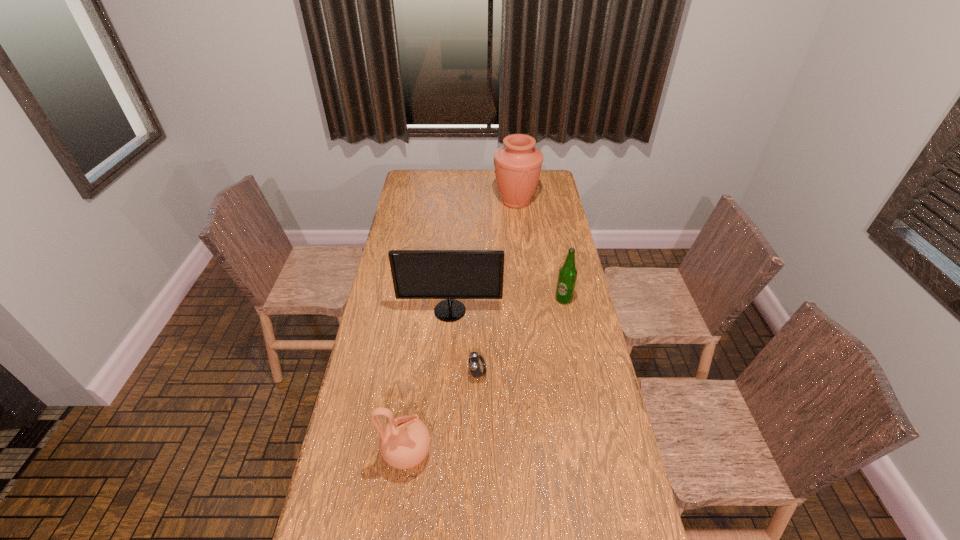
The width and height of the screenshot is (960, 540). I want to click on vase, so click(x=518, y=163).

Identify the location of computer monitor. This screenshot has height=540, width=960. (417, 274).

Identify the location of beer bottle. Image resolution: width=960 pixels, height=540 pixels. (567, 276).

Locate an element on the screen. The image size is (960, 540). the nearest object is located at coordinates (404, 442).

Find the location of a particular element. The width and height of the screenshot is (960, 540). alarm clock is located at coordinates (477, 366).

I want to click on the shortest object, so click(x=477, y=366).

You are a GUI agent. You are given a task and a screenshot of the screen. Output one action in this format:
    pyautogui.click(x=<x>, y=<y>)
    Task: Click on the vacant area situated 0.330m on the front of the vase
    The image size is (960, 540).
    Given the screenshot: What is the action you would take?
    pyautogui.click(x=521, y=256)

The image size is (960, 540). I want to click on free spot located on the front-facing side of the computer monitor, so click(445, 382).

Where is `free region located on the label of the beer bottle`? free region located on the label of the beer bottle is located at coordinates (567, 316).

Identify the location of vacant space located on the spout of the nearest object. The image size is (960, 540). (566, 453).